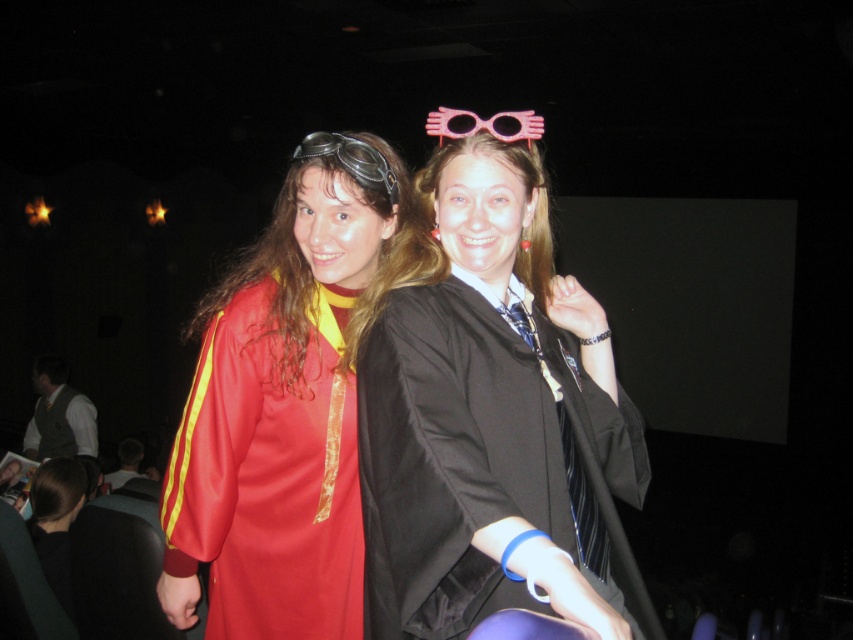
Question: Considering the relative positions of matte red gown at center and matte gray vest at lower left in the image provided, where is matte red gown at center located with respect to matte gray vest at lower left?

Choices:
 (A) above
 (B) below

Answer: (A)

Question: In this image, where is matte gray vest at lower left located relative to dark brown leather jacket at lower left?

Choices:
 (A) right
 (B) left

Answer: (B)

Question: Does matte black graduation gown at center have a smaller size compared to dark brown leather jacket at lower left?

Choices:
 (A) no
 (B) yes

Answer: (A)

Question: Which point is farther to the camera?

Choices:
 (A) (138, 442)
 (B) (80, 426)
 (C) (518, 173)

Answer: (A)

Question: Based on their relative distances, which object is farther from the matte black graduation gown at center?

Choices:
 (A) matte red gown at center
 (B) dark brown leather jacket at lower left
 (C) matte gray vest at lower left

Answer: (C)

Question: Considering the real-world distances, which object is farthest from the matte gray vest at lower left?

Choices:
 (A) dark brown leather jacket at lower left
 (B) matte black graduation gown at center

Answer: (B)